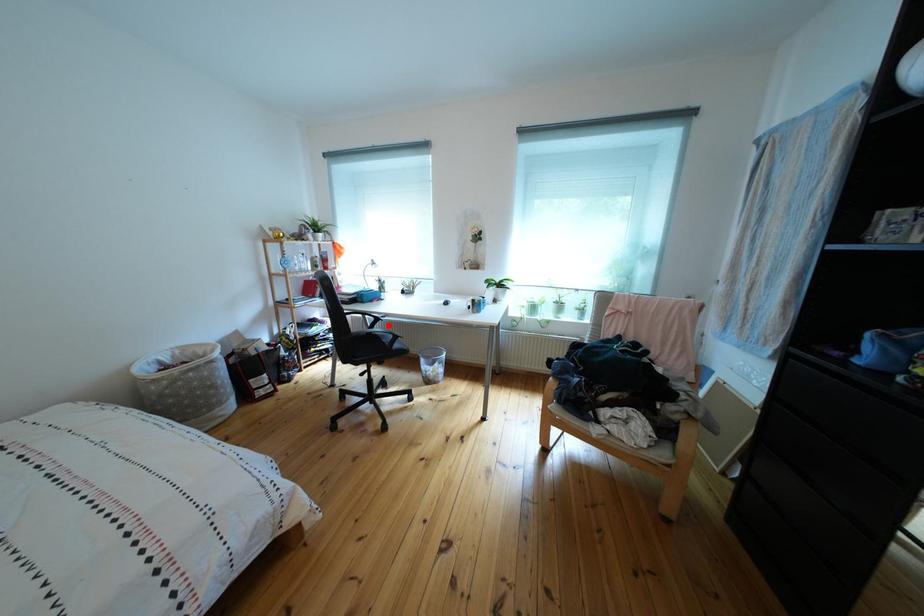
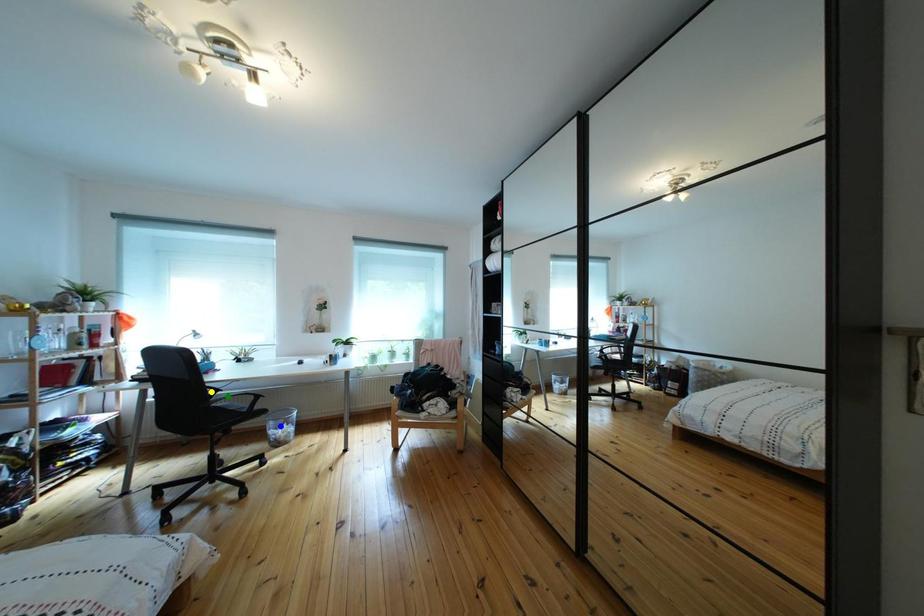
Question: I am providing you with two images of the same scene from different viewpoints. A red point is marked on the first image. You are given multiple points on the second image. Which spot in image 2 lines up with the point in image 1?

Choices:
 (A) blue point
 (B) green point
 (C) yellow point

Answer: (B)